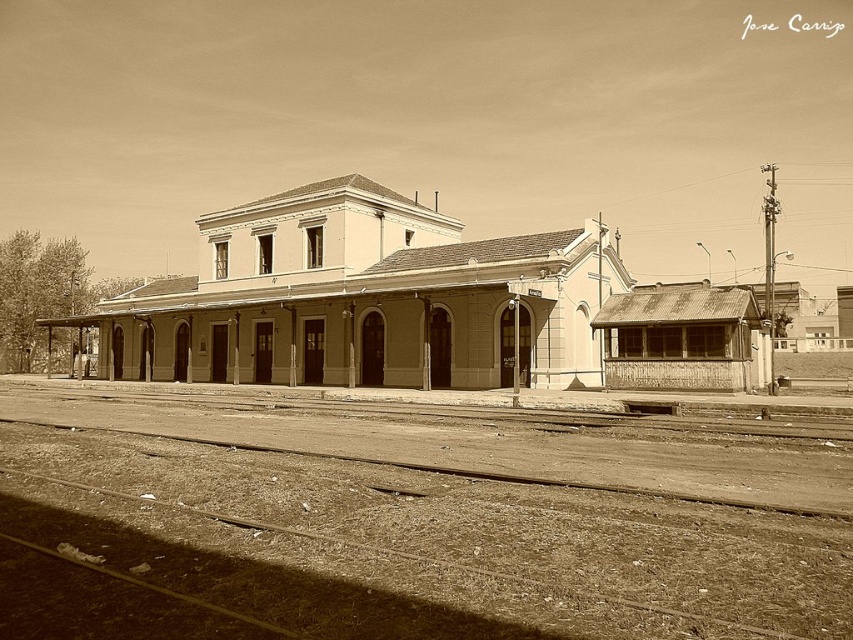
Question: Is brown dirt track at lower center in front of brown wooden train track at lower center?

Choices:
 (A) no
 (B) yes

Answer: (B)

Question: Can you confirm if brown dirt track at lower center is wider than brown wooden train track at lower center?

Choices:
 (A) no
 (B) yes

Answer: (B)

Question: Does brown dirt track at lower center have a lesser width compared to brown wooden train track at lower center?

Choices:
 (A) yes
 (B) no

Answer: (B)

Question: Among these objects, which one is nearest to the camera?

Choices:
 (A) brown dirt track at lower center
 (B) brown wooden train track at lower center

Answer: (A)

Question: Which point is farther to the camera?

Choices:
 (A) (444, 472)
 (B) (161, 563)

Answer: (A)

Question: Which point is closer to the camera taking this photo?

Choices:
 (A) (260, 449)
 (B) (802, 490)

Answer: (B)